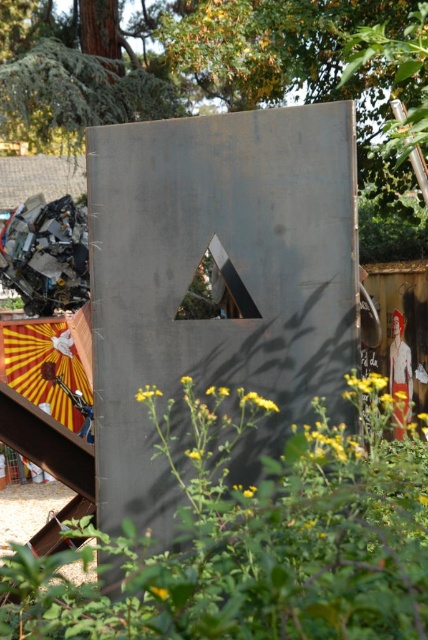
Can you confirm if yellow striped fabric umbrella at lower left is bigger than white matte dress at right?

Yes, yellow striped fabric umbrella at lower left is bigger than white matte dress at right.

Looking at this image, does yellow striped fabric umbrella at lower left lie behind white matte dress at right?

Yes, yellow striped fabric umbrella at lower left is behind white matte dress at right.

The height and width of the screenshot is (640, 428). I want to click on yellow striped fabric umbrella at lower left, so click(45, 368).

Is green matte plant at center below white matte dress at right?

No, green matte plant at center is not below white matte dress at right.

Describe the element at coordinates (255, 540) in the screenshot. I see `green matte plant at center` at that location.

This screenshot has width=428, height=640. What do you see at coordinates (255, 540) in the screenshot?
I see `green matte plant at center` at bounding box center [255, 540].

Identify the location of green matte plant at center. Image resolution: width=428 pixels, height=640 pixels. (255, 540).

Does green matte plant at center appear under yellow striped fabric umbrella at lower left?

No.

Who is shorter, green matte plant at center or yellow striped fabric umbrella at lower left?

green matte plant at center is shorter.

Is point (104, 616) positioned behind point (11, 356)?

No, it is in front of (11, 356).

I want to click on green matte plant at center, so click(x=255, y=540).